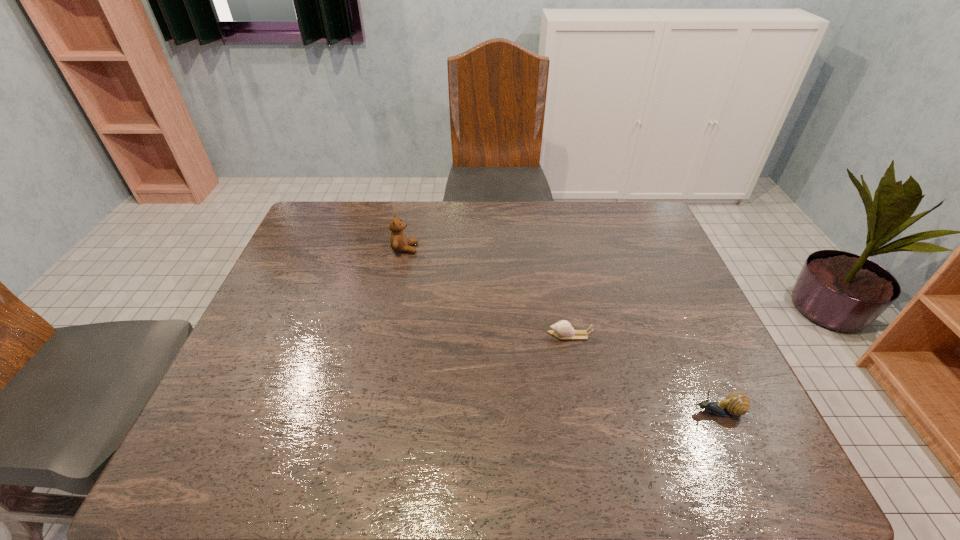
At what (x,y) coordinates should I click in order to perform the action: click on object that ranks as the second closest to the farthest object. Please return your answer as a coordinate pair (x, y). The image size is (960, 540). Looking at the image, I should click on (736, 404).

Identify the location of object that stands as the closest to the teddy bear. (563, 329).